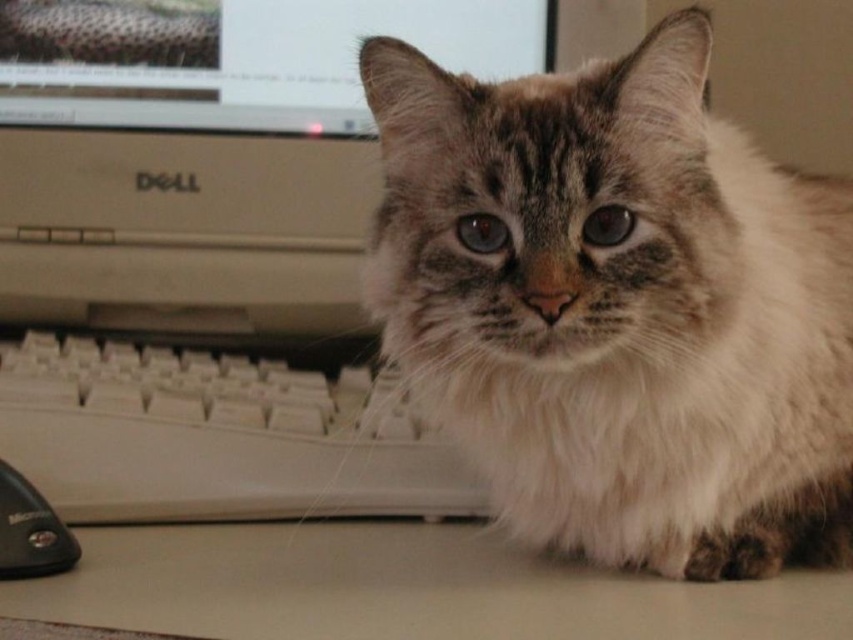
You are a robotic arm trying to reach the black plastic mouse at lower left from the matte plastic monitor at upper center. The robotic arm has a maximum reach of 25 inches. Can it reach the mouse?

The distance between the matte plastic monitor at upper center and the black plastic mouse at lower left is 25.92 inches, which exceeds the robotic arm maximum reach of 25 inches. Therefore, the robotic arm cannot reach the mouse.

You are a photographer trying to capture the fuzzy fur cat at center and the matte plastic monitor at upper center in a single frame. Based on their positions, can you tell which object is closer to the camera?

The fuzzy fur cat at center is below the matte plastic monitor at upper center, meaning the cat is closer to the camera since it is positioned lower in the frame.

You are trying to determine the shortest path between the two points in the image. Which point, point (550, 518) or point (97, 385), is closer to you and would be the starting point of the shortest path?

Point (550, 518) is closer to the viewer than point (97, 385), so it would be the starting point of the shortest path.